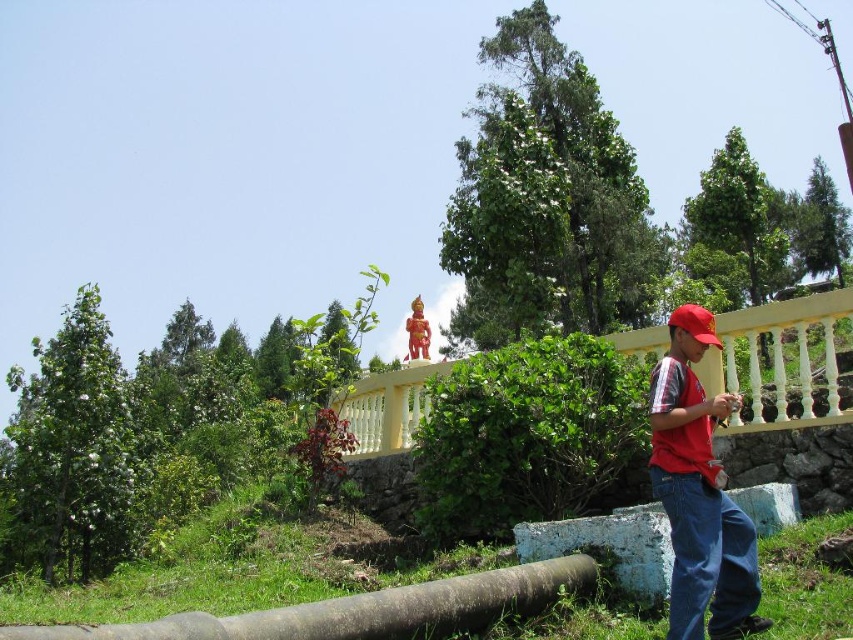
You are standing at the yellow railing in the park and see two points marked in the image. Which point, point (664, 483) or point (595, 576), is closer to you?

Point (664, 483) is closer to the viewer than point (595, 576).

You are a painter standing on the brown rubber log at lower center and want to paint the yellow painted wood at upper center. Can you reach it without moving from your current position?

The yellow painted wood at upper center is further to the viewer than brown rubber log at lower center, so you can reach it without moving from your current position.